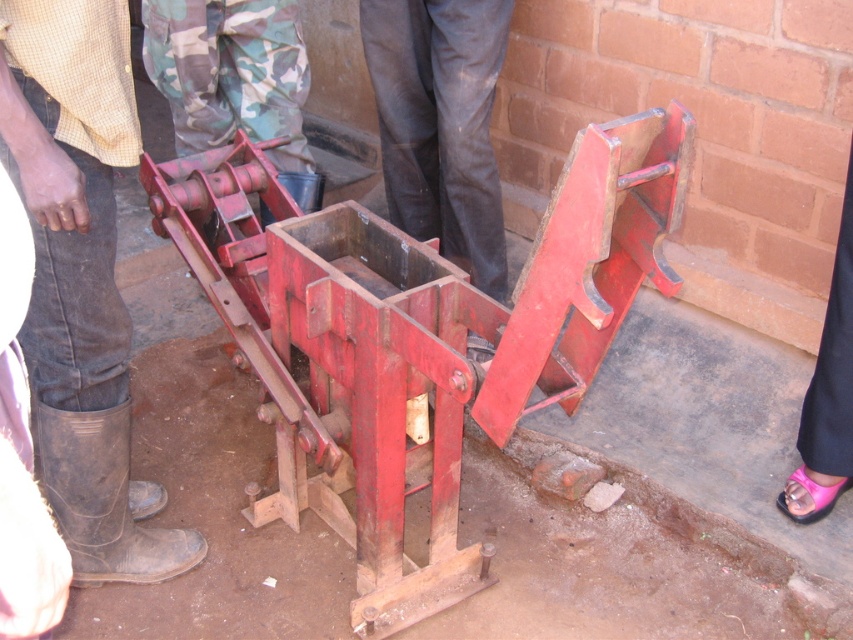
You are standing in a farm workshop and see the red metal structure. There is a point at coordinates [415,337]. What object is located at that point?

The point at coordinates [415,337] indicates the rusty metal press at center.

From the picture: You are standing at the center of the image and want to move towards the pink leather sandal at lower right. Which direction should you move in to reach it?

The pink leather sandal at lower right is located at point 0.617 on the x axis and 0.971 on the y axis. Since you are at the center, you need to move towards the lower right direction to reach it.